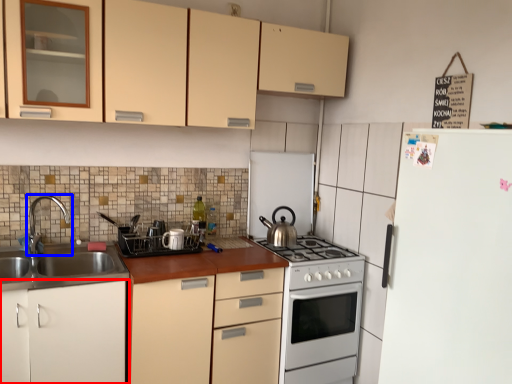
Question: Which of the following is the farthest to the observer, cabinetry (highlighted by a red box) or tap (highlighted by a blue box)?

Choices:
 (A) cabinetry
 (B) tap

Answer: (B)